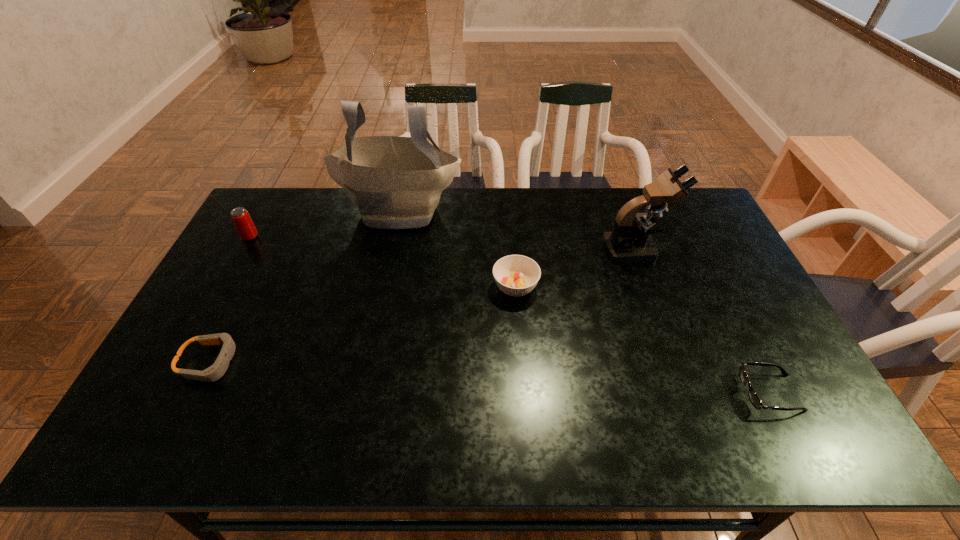
The width and height of the screenshot is (960, 540). In order to click on vacant area that lies between the goggles and the spectacles in this screenshot , I will do `click(490, 377)`.

At what (x,y) coordinates should I click in order to perform the action: click on empty space that is in between the fourth tallest object and the shopping bag. Please return your answer as a coordinate pair (x, y). The image size is (960, 540). Looking at the image, I should click on (458, 248).

Image resolution: width=960 pixels, height=540 pixels. In order to click on free space between the beer can and the soup bowl in this screenshot , I will do `click(383, 262)`.

At what (x,y) coordinates should I click in order to perform the action: click on free area in between the farthest object and the second object from right to left. Please return your answer as a coordinate pair (x, y). This screenshot has width=960, height=540. Looking at the image, I should click on (517, 230).

I want to click on free space between the fourth shortest object and the spectacles, so click(x=510, y=315).

The image size is (960, 540). I want to click on free space between the rightmost object and the second object from right to left, so click(703, 321).

Where is `object that stands as the closest to the spectacles`? This screenshot has width=960, height=540. object that stands as the closest to the spectacles is located at coordinates (630, 241).

Locate which object is the second closest to the farthest object. Please provide its 2D coordinates. Your answer should be formatted as a tuple, i.e. [(x, y)], where the tuple contains the x and y coordinates of a point satisfying the conditions above.

[(240, 216)]